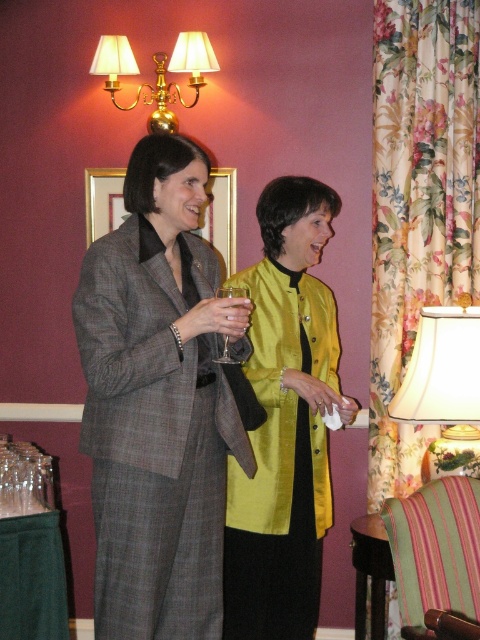
Question: Is plaid wool suit at center bigger than white fabric lampshade at right?

Choices:
 (A) yes
 (B) no

Answer: (A)

Question: Which of the following is the closest to the observer?

Choices:
 (A) (264, 348)
 (B) (412, 81)
 (C) (213, 625)
 (D) (229, 362)

Answer: (D)

Question: Which of the following is the closest to the observer?

Choices:
 (A) click(x=175, y=156)
 (B) click(x=106, y=58)
 (C) click(x=434, y=314)

Answer: (A)

Question: Is silky yellow blouse at center behind clear glass wine glass at center?

Choices:
 (A) yes
 (B) no

Answer: (A)

Question: Which point is closer to the camera?

Choices:
 (A) (377, 168)
 (B) (115, 488)
 (C) (285, 516)
 (D) (472, 403)

Answer: (B)

Question: Does floral fabric curtain at right have a lesser width compared to clear glass wine glass at center?

Choices:
 (A) no
 (B) yes

Answer: (A)